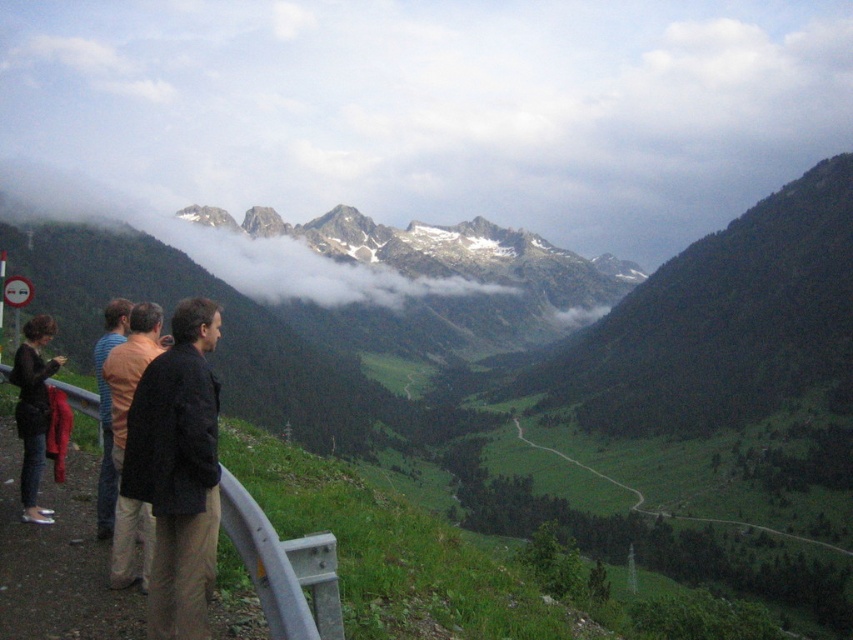
You are a photographer trying to capture a photo of the black fabric jacket at center and the dark blue jeans at left. Which object should you focus on first if you want both to be in sharp focus?

The black fabric jacket at center is closer to the viewer than the dark blue jeans at left. To ensure both are in sharp focus, focus on the black fabric jacket at center first, as it is closer, and the dark blue jeans at left will fall within the depth of field if properly set.

You are a hiker who wants to take a photo of the scenic valley while standing near the guardrail. You notice the black fabric jacket at center and the dark blue jeans at left in your viewfinder. Which object should you adjust your position to avoid blocking the view of the valley?

You should adjust your position to avoid the dark blue jeans at left because the black fabric jacket at center is to the right of it, so moving left might block the view of the valley.